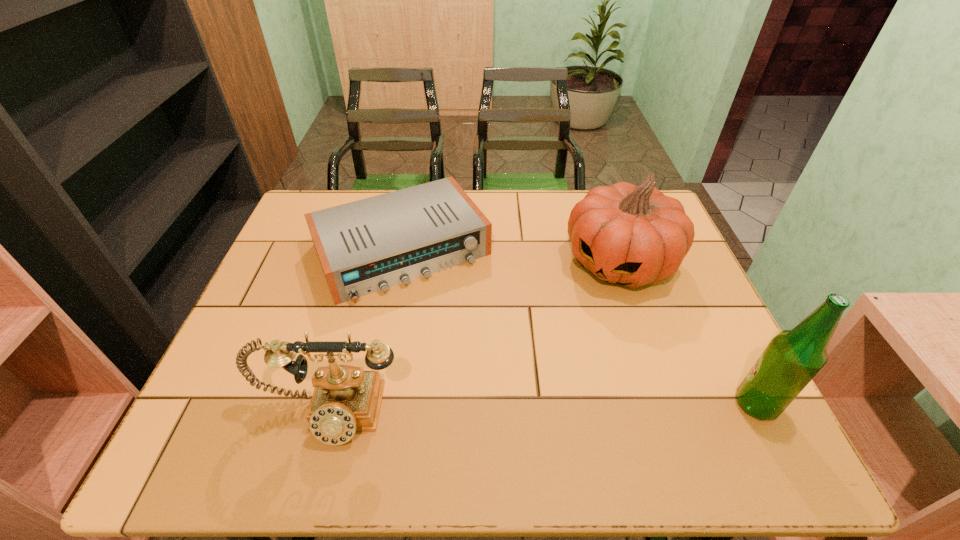
Where is `pumpkin at the right edge`? The image size is (960, 540). pumpkin at the right edge is located at coordinates (632, 235).

In order to click on object located in the far left corner section of the desktop in this screenshot , I will do `click(365, 246)`.

The width and height of the screenshot is (960, 540). Find the location of `object that is at the near left corner`. object that is at the near left corner is located at coordinates (346, 399).

Identify the location of object at the far right corner. The height and width of the screenshot is (540, 960). (632, 235).

Locate an element on the screen. The width and height of the screenshot is (960, 540). object that is at the near right corner is located at coordinates coord(792,359).

Locate an element on the screen. Image resolution: width=960 pixels, height=540 pixels. free point at the far edge is located at coordinates (514, 222).

Where is `vacant region at the near edge of the desktop`? vacant region at the near edge of the desktop is located at coordinates (460, 384).

Identify the location of free spot at the left edge of the desktop. This screenshot has height=540, width=960. (270, 316).

In the image, there is a desktop. Where is `vacant space at the right edge`? The width and height of the screenshot is (960, 540). vacant space at the right edge is located at coordinates (720, 379).

The image size is (960, 540). In order to click on vacant area at the far left corner in this screenshot , I will do `click(331, 194)`.